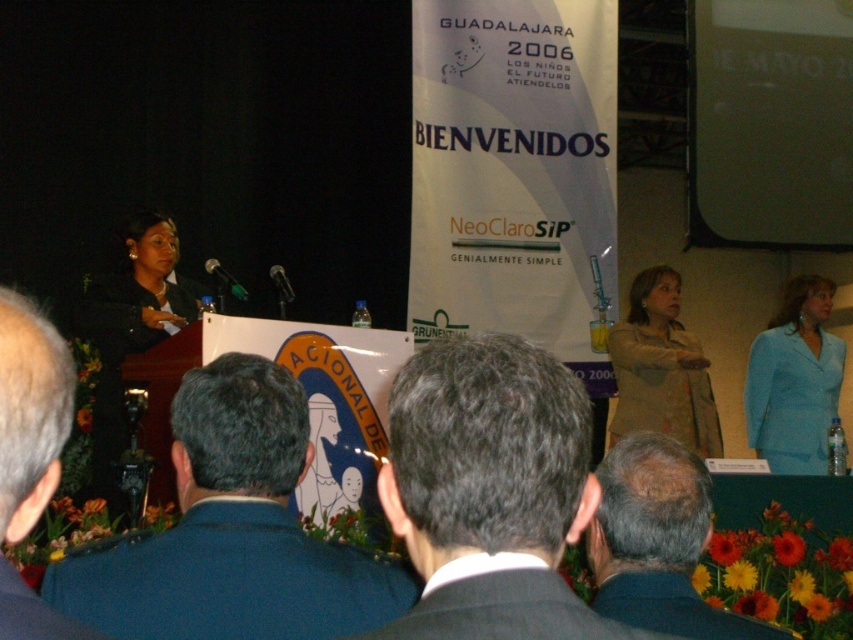
Is dark gray suit at lower center behind tan fabric jacket at center?

No, it is in front of tan fabric jacket at center.

At what (x,y) coordinates should I click in order to perform the action: click on dark gray suit at lower center. Please return your answer as a coordinate pair (x, y). Looking at the image, I should click on (657, 541).

Measure the distance between dark suit at center and camera.

dark suit at center and camera are 28.05 inches apart from each other.

Is dark suit at center shorter than tan fabric jacket at center?

Yes, dark suit at center is shorter than tan fabric jacket at center.

Between point (421, 531) and point (682, 390), which one is positioned in front?

Point (421, 531) is more forward.

This screenshot has height=640, width=853. Find the location of `dark suit at center`. dark suit at center is located at coordinates (490, 492).

Is light blue fabric suit at center above tan fabric jacket at center?

Incorrect, light blue fabric suit at center is not positioned above tan fabric jacket at center.

Image resolution: width=853 pixels, height=640 pixels. What do you see at coordinates (793, 380) in the screenshot?
I see `light blue fabric suit at center` at bounding box center [793, 380].

Identify the location of light blue fabric suit at center. The height and width of the screenshot is (640, 853). (793, 380).